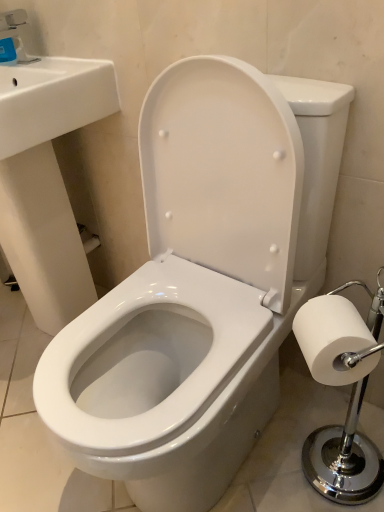
What do you see at coordinates (335, 340) in the screenshot? I see `white paper at right` at bounding box center [335, 340].

In order to face white glossy sink at upper left, should I rotate leftwards or rightwards?

You should rotate left by 21.808 degrees.

What do you see at coordinates (46, 174) in the screenshot?
I see `white glossy sink at upper left` at bounding box center [46, 174].

The image size is (384, 512). What do you see at coordinates (13, 38) in the screenshot?
I see `matte blue plastic faucet at upper left` at bounding box center [13, 38].

At what (x,y) coordinates should I click in order to perform the action: click on white paper at right. Please return your answer as a coordinate pair (x, y). Image resolution: width=384 pixels, height=512 pixels. Looking at the image, I should click on (335, 340).

From the image's perspective, which is above, white paper at right or matte blue plastic faucet at upper left?

matte blue plastic faucet at upper left appears higher in the image.

In the scene shown: Between white paper at right and matte blue plastic faucet at upper left, which one has smaller size?

Smaller between the two is matte blue plastic faucet at upper left.

Is matte blue plastic faucet at upper left at the back of white paper at right?

No, white paper at right is not facing the opposite direction of matte blue plastic faucet at upper left.

Which is in front, point (23, 256) or point (23, 55)?

The point (23, 55) is in front.

Considering the relative positions of white glossy sink at upper left and matte blue plastic faucet at upper left in the image provided, is white glossy sink at upper left to the right of matte blue plastic faucet at upper left from the viewer's perspective?

Correct, you'll find white glossy sink at upper left to the right of matte blue plastic faucet at upper left.

Relative to matte blue plastic faucet at upper left, is white glossy sink at upper left in front or behind?

white glossy sink at upper left is in front of matte blue plastic faucet at upper left.

Considering the relative sizes of white glossy sink at upper left and matte blue plastic faucet at upper left in the image provided, is white glossy sink at upper left wider than matte blue plastic faucet at upper left?

Yes, white glossy sink at upper left is wider than matte blue plastic faucet at upper left.

Considering the sizes of objects white glossy sink at upper left and white paper at right in the image provided, who is shorter, white glossy sink at upper left or white paper at right?

white paper at right.

What's the angular difference between white glossy sink at upper left and white paper at right's facing directions?

The angle between the facing direction of white glossy sink at upper left and the facing direction of white paper at right is 44.1 degrees.

From the image's perspective, is white glossy sink at upper left under white paper at right?

Incorrect, from the image's perspective, white glossy sink at upper left is higher than white paper at right.

Is white glossy sink at upper left beside white paper at right?

white glossy sink at upper left and white paper at right are not in contact.

From a real-world perspective, is matte blue plastic faucet at upper left under white glossy sink at upper left?

No, from a real-world perspective, matte blue plastic faucet at upper left is not below white glossy sink at upper left.

Considering the relative sizes of matte blue plastic faucet at upper left and white glossy sink at upper left in the image provided, is matte blue plastic faucet at upper left wider than white glossy sink at upper left?

No, matte blue plastic faucet at upper left is not wider than white glossy sink at upper left.

Who is smaller, matte blue plastic faucet at upper left or white glossy sink at upper left?

matte blue plastic faucet at upper left.

From the image's perspective, is matte blue plastic faucet at upper left located beneath white glossy sink at upper left?

No, from the image's perspective, matte blue plastic faucet at upper left is not beneath white glossy sink at upper left.

From the image's perspective, which object appears higher, matte blue plastic faucet at upper left or white paper at right?

matte blue plastic faucet at upper left.

Between point (26, 56) and point (294, 331), which one is positioned in front?

Point (294, 331)

Is matte blue plastic faucet at upper left thinner than white paper at right?

Yes, matte blue plastic faucet at upper left is thinner than white paper at right.

Is white paper at right not near white glossy sink at upper left?

No, there isn't a large distance between white paper at right and white glossy sink at upper left.

Is white paper at right smaller than white glossy sink at upper left?

Indeed, white paper at right has a smaller size compared to white glossy sink at upper left.

Is white paper at right completely or partially outside of white glossy sink at upper left?

Absolutely, white paper at right is external to white glossy sink at upper left.

Identify the location of toilet paper below the white glossy sink at upper left (from a real-world perspective). This screenshot has width=384, height=512. (335, 340).

Locate an element on the screen. Image resolution: width=384 pixels, height=512 pixels. toilet paper in front of the matte blue plastic faucet at upper left is located at coordinates (335, 340).

Where is `faucet above the white glossy sink at upper left (from the image's perspective)`? This screenshot has height=512, width=384. faucet above the white glossy sink at upper left (from the image's perspective) is located at coordinates (13, 38).

Estimate the real-world distances between objects in this image. Which object is closer to matte blue plastic faucet at upper left, white glossy sink at upper left or white paper at right?

Result: Based on the image, white glossy sink at upper left appears to be nearer to matte blue plastic faucet at upper left.

In the scene shown: When comparing their distances from white paper at right, does matte blue plastic faucet at upper left or white glossy sink at upper left seem closer?

white glossy sink at upper left lies closer to white paper at right than the other object.

Estimate the real-world distances between objects in this image. Which object is further from white glossy sink at upper left, white paper at right or matte blue plastic faucet at upper left?

The object further to white glossy sink at upper left is white paper at right.

Based on the photo, when comparing their distances from white paper at right, does white glossy sink at upper left or matte blue plastic faucet at upper left seem closer?

Based on the image, white glossy sink at upper left appears to be nearer to white paper at right.

Looking at the image, which one is located further to matte blue plastic faucet at upper left, white paper at right or white glossy sink at upper left?

Among the two, white paper at right is located further to matte blue plastic faucet at upper left.

Estimate the real-world distances between objects in this image. Which object is closer to white glossy sink at upper left, matte blue plastic faucet at upper left or white paper at right?

Among the two, matte blue plastic faucet at upper left is located nearer to white glossy sink at upper left.

The height and width of the screenshot is (512, 384). I want to click on sink located between matte blue plastic faucet at upper left and white paper at right in the left-right direction, so click(x=46, y=174).